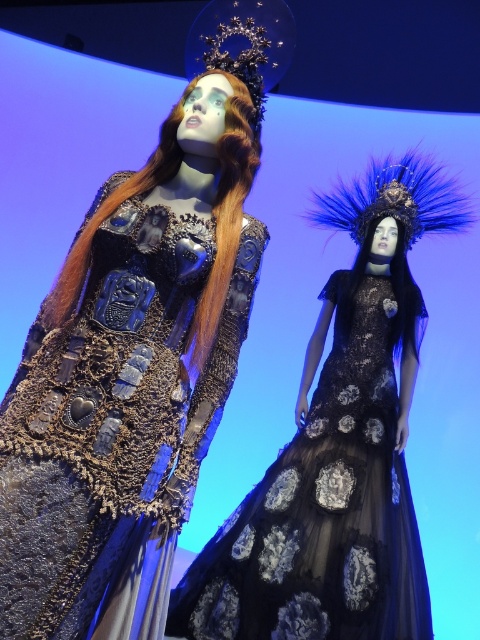
Question: Observing the image, what is the correct spatial positioning of shiny metallic dress at center in reference to black tulle dress at center?

Choices:
 (A) below
 (B) above

Answer: (B)

Question: Is shiny metallic dress at center smaller than black tulle dress at center?

Choices:
 (A) yes
 (B) no

Answer: (A)

Question: Which object appears farthest from the camera in this image?

Choices:
 (A) black tulle dress at center
 (B) shiny metallic dress at center

Answer: (A)

Question: Which point is closer to the camera?

Choices:
 (A) shiny metallic dress at center
 (B) black tulle dress at center

Answer: (A)

Question: Does shiny metallic dress at center appear over black tulle dress at center?

Choices:
 (A) yes
 (B) no

Answer: (A)